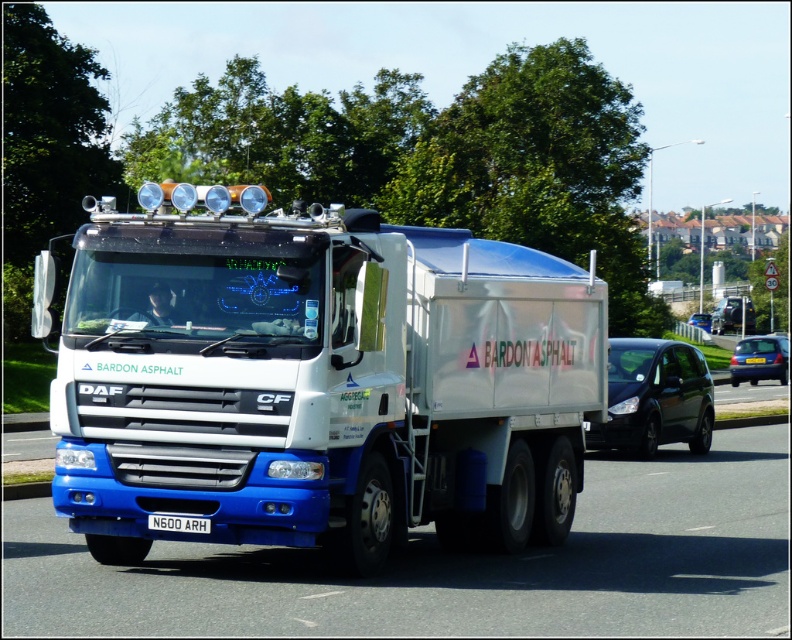
You are a traffic officer observing a road with two vehicles, a black matte van at right and a blue metallic van at center. Which van is narrower?

The black matte van at right has a lesser width compared to the blue metallic van at center, so it is narrower.

You are a traffic officer observing a white glossy truck at center and a white metallic license plate at center on the road. Which object is taller?

The white glossy truck at center is much taller than the white metallic license plate at center.

Based on the photo, you are a traffic officer observing the road. You notice a blue metallic hatchback at right and a white metallic license plate at center. Which vehicle is positioned more to the right side of the road?

The blue metallic hatchback at right is positioned more to the right side of the road than the white metallic license plate at center.